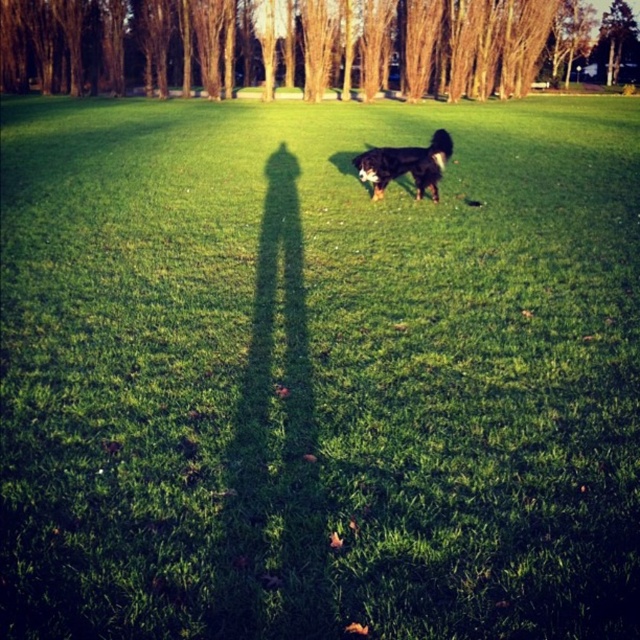
What do you see at coordinates (291, 44) in the screenshot? This screenshot has height=640, width=640. I see `brown bark tree at center` at bounding box center [291, 44].

Between point (486, 65) and point (392, 170), which one is positioned in front?

Point (392, 170) is in front.

The image size is (640, 640). I want to click on brown bark tree at center, so click(x=291, y=44).